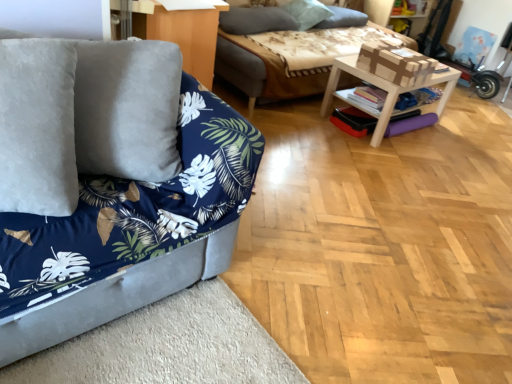
Question: From a real-world perspective, is wooden table at center physically located above or below gray soft pillow at upper center, which is the second pillow from left to right?

Choices:
 (A) above
 (B) below

Answer: (B)

Question: Is point (327, 92) positioned closer to the camera than point (288, 11)?

Choices:
 (A) farther
 (B) closer

Answer: (B)

Question: Based on their relative distances, which object is farther from the soft gray pillow at upper center, acting as the first pillow starting from the right?

Choices:
 (A) gray soft pillow at upper center, which is counted as the 1th pillow, starting from the left
 (B) velvet blue couch at left, which ranks as the 1th studio couch in bottom-to-top order
 (C) gray soft pillow at upper center, which is the second pillow from left to right
 (D) matte wood dresser at upper center
 (E) wooden table at center

Answer: (B)

Question: Which is farther from the velvet blue couch at left, the 2th studio couch positioned from the top?

Choices:
 (A) gray soft pillow at upper center, which is the 2th pillow from right to left
 (B) matte wood dresser at upper center
 (C) wooden table at center
 (D) gray soft pillow at upper center, the third pillow when ordered from right to left
 (E) soft gray pillow at upper center, acting as the first pillow starting from the right

Answer: (E)